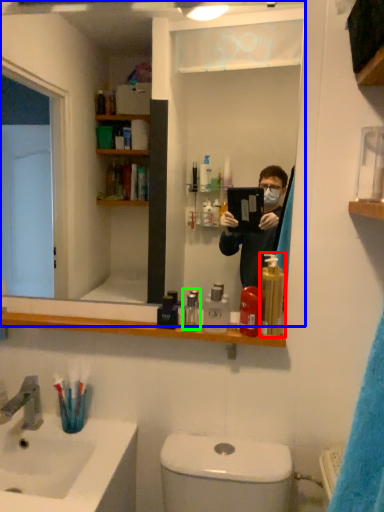
Question: Which is farther away from soap dispenser (highlighted by a red box)? mirror (highlighted by a blue box) or mouthwash (highlighted by a green box)?

Choices:
 (A) mirror
 (B) mouthwash

Answer: (A)